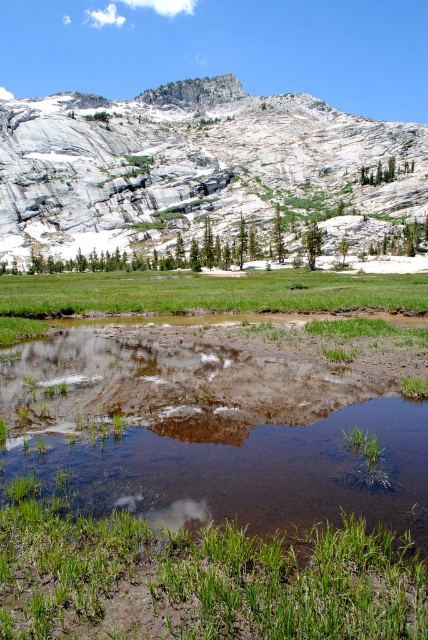
You are a hiker who wants to cross the area with the least resistance. You notice two patches of green grass at lower center and green grass at center. Which patch of grass would be easier to walk through based on their height?

The green grass at lower center has a lesser height compared to green grass at center, so it would be easier to walk through the green grass at lower center since shorter grass offers less resistance.

You are a hiker standing at the edge of the clear water at center and green grass at center. Which surface would you choose to walk on if you want to avoid getting your shoes wet?

You should walk on the green grass at center because the clear water at center is in front of it, meaning the grass is behind and likely dry ground.